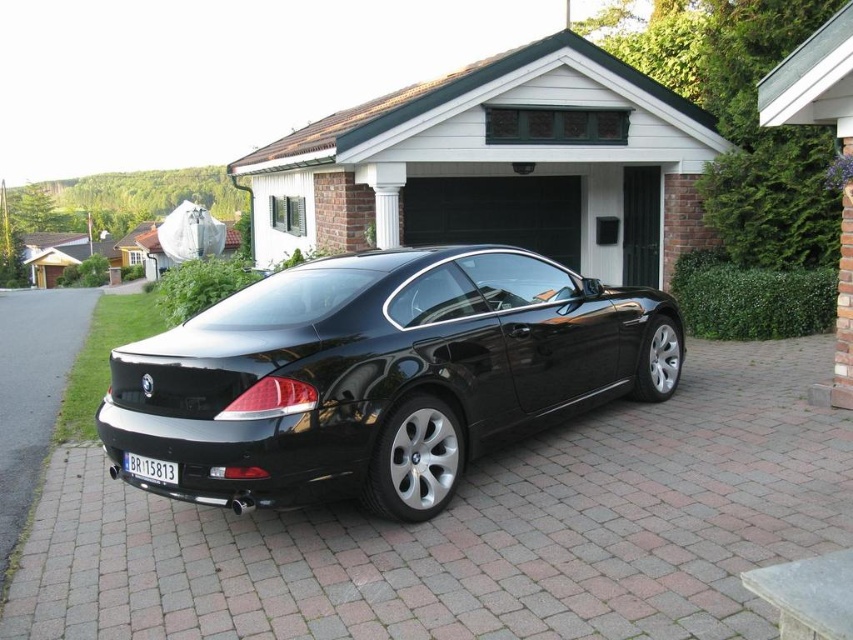
You are a delivery person trying to park a small van in the driveway. The van requires a space that is at least twice as large as the white plastic license plate at center. Can the brick paved driveway at lower left accommodate the van?

The brick paved driveway at lower left has a larger size compared to the white plastic license plate at center. However, the description does not specify the exact dimensions of the driveway or the required space for the van. Without knowing the actual size of the license plate or the driveway, it is impossible to determine if the driveway is twice as large as needed. Please check the exact measurements before deciding.

You are standing in front of the black BMW car parked on the brick driveway. There is a point marked at coordinates (497, 164). What object does this point correspond to?

Result: The point at coordinates (497, 164) corresponds to the green wood garage door at center.

You are standing in front of the black BMW car on the brick driveway. There are two points marked on the car, one at coordinates point (358, 134) and the other at point (135, 458). Which point is closer to you?

Point (135, 458) is closer to you because it is less further to the camera than point (358, 134).